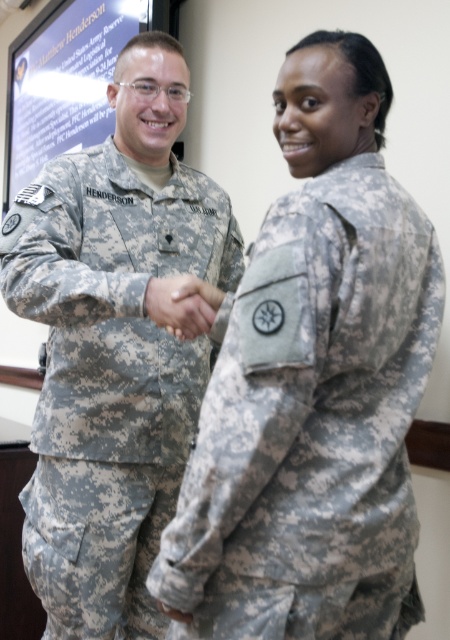
What do you see at coordinates (113, 346) in the screenshot?
I see `camouflage uniform at left` at bounding box center [113, 346].

Between camouflage uniform at left and camouflage fabric hand at center, which one has more height?

camouflage uniform at left

Between point (8, 218) and point (171, 300), which one is positioned in front?

Point (171, 300)

At what (x,y) coordinates should I click in order to perform the action: click on camouflage uniform at left. Please return your answer as a coordinate pair (x, y). Looking at the image, I should click on (113, 346).

Between point (327, 61) and point (194, 324), which one is positioned in front?

Positioned in front is point (327, 61).

Is camouflage uniform at center to the right of camouflage fabric hand at center from the viewer's perspective?

Yes, camouflage uniform at center is to the right of camouflage fabric hand at center.

What do you see at coordinates (314, 387) in the screenshot? The image size is (450, 640). I see `camouflage uniform at center` at bounding box center [314, 387].

I want to click on camouflage uniform at center, so (x=314, y=387).

Between point (215, 600) and point (85, 225), which one is positioned behind?

The point (85, 225) is behind.

I want to click on camouflage uniform at center, so (314, 387).